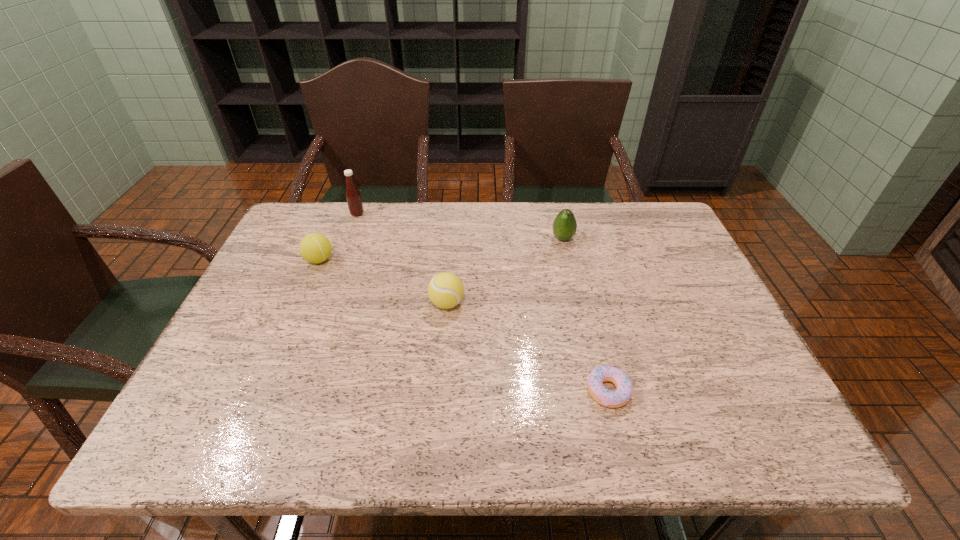
Locate an element on the screen. free spot between the Tabasco sauce and the left tennis ball is located at coordinates (338, 237).

Where is `empty space that is in between the tallest object and the farther tennis ball`? The image size is (960, 540). empty space that is in between the tallest object and the farther tennis ball is located at coordinates (338, 237).

In order to click on vacant space in between the shortest object and the avocado in this screenshot , I will do `click(586, 315)`.

This screenshot has width=960, height=540. I want to click on empty space between the farther tennis ball and the farthest object, so click(338, 237).

Where is `vacant region between the second nearest object and the doughnut`? Image resolution: width=960 pixels, height=540 pixels. vacant region between the second nearest object and the doughnut is located at coordinates (527, 347).

The width and height of the screenshot is (960, 540). I want to click on object that is the fourth closest one to the fourth nearest object, so click(315, 248).

Locate which object is the closest to the second farthest object. Please provide its 2D coordinates. Your answer should be formatted as a tuple, i.e. [(x, y)], where the tuple contains the x and y coordinates of a point satisfying the conditions above.

[(445, 290)]

You are a GUI agent. You are given a task and a screenshot of the screen. Output one action in this format:
    pyautogui.click(x=<x>, y=<y>)
    Task: Click on the free location that satisfies the following two spatial constraints: 1. on the back side of the fourth nearest object; 2. on the left side of the left tennis ball
    
    Given the screenshot: What is the action you would take?
    pyautogui.click(x=328, y=239)

Locate an element on the screen. This screenshot has width=960, height=540. vacant space that satisfies the following two spatial constraints: 1. on the back side of the left tennis ball; 2. on the left side of the fourth nearest object is located at coordinates pyautogui.click(x=328, y=239).

Identify the location of free space that satisfies the following two spatial constraints: 1. on the front side of the fourth nearest object; 2. on the left side of the shortest object. (598, 391).